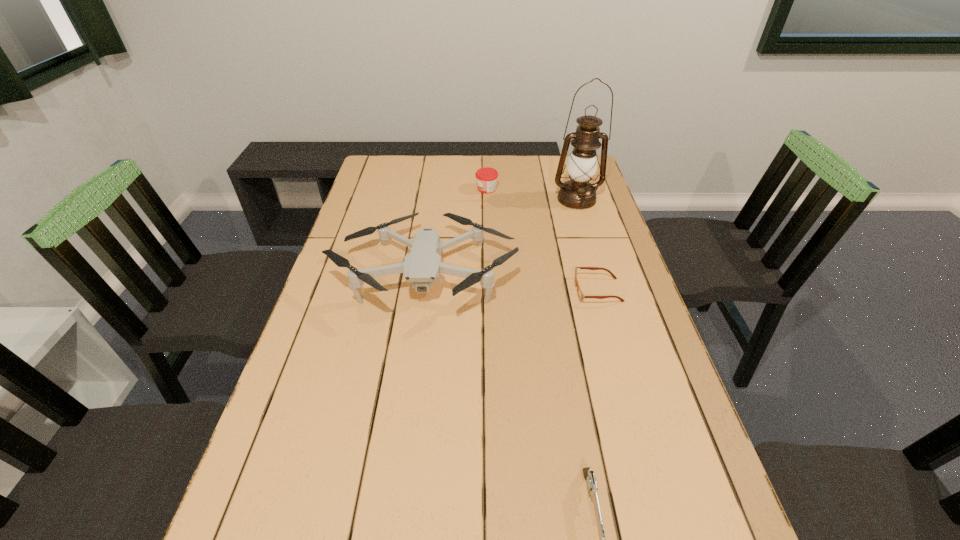
Where is `vacant position located 0.400m on the front-facing side of the shortest object`? Image resolution: width=960 pixels, height=540 pixels. vacant position located 0.400m on the front-facing side of the shortest object is located at coordinates (429, 291).

Image resolution: width=960 pixels, height=540 pixels. What are the coordinates of `free space located on the front-facing side of the shortest object` in the screenshot? It's located at (531, 291).

You are a GUI agent. You are given a task and a screenshot of the screen. Output one action in this format:
    pyautogui.click(x=<x>, y=<y>)
    Task: Click on the object located at the far edge
    
    Given the screenshot: What is the action you would take?
    pyautogui.click(x=486, y=177)

The height and width of the screenshot is (540, 960). Find the location of `object present at the left edge`. object present at the left edge is located at coordinates (422, 266).

Image resolution: width=960 pixels, height=540 pixels. I want to click on oil lamp positioned at the right edge, so click(578, 193).

Find the location of `spectacles present at the right edge`. spectacles present at the right edge is located at coordinates (581, 296).

You are a GUI agent. You are given a task and a screenshot of the screen. Output one action in this format:
    pyautogui.click(x=<x>, y=<y>)
    Task: Click on the vacant space at the far edge of the desktop
    This screenshot has width=960, height=540.
    Given the screenshot: What is the action you would take?
    pyautogui.click(x=431, y=158)

At what (x,y) coordinates should I click in order to perform the action: click on free space at the left edge of the desktop. Please return your answer as a coordinate pair (x, y). Looking at the image, I should click on (375, 220).

Image resolution: width=960 pixels, height=540 pixels. I want to click on free point at the right edge, so click(615, 364).

The width and height of the screenshot is (960, 540). What are the coordinates of `vacant space at the far left corner` in the screenshot? It's located at (396, 172).